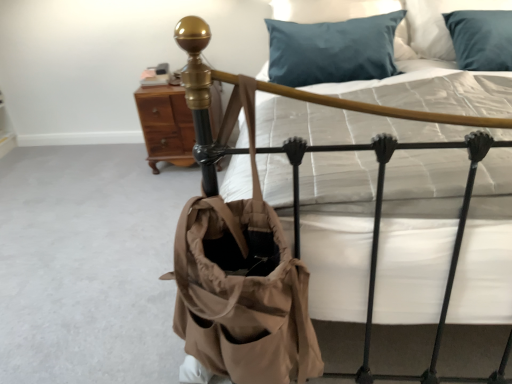
Identify the location of blank space to the left of white quilted mattress at center. (102, 266).